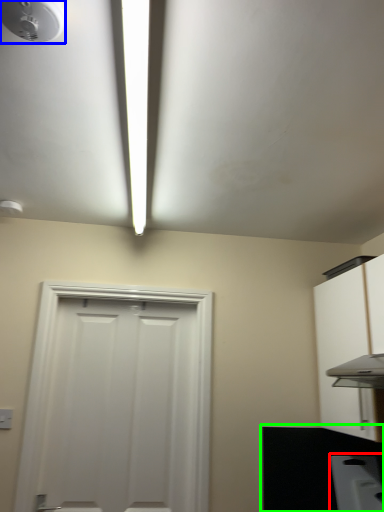
Question: Which object is positioned farthest from appliance (highlighted by a red box)? Select from droplight (highlighted by a blue box) and counter top (highlighted by a green box).

Choices:
 (A) droplight
 (B) counter top

Answer: (A)